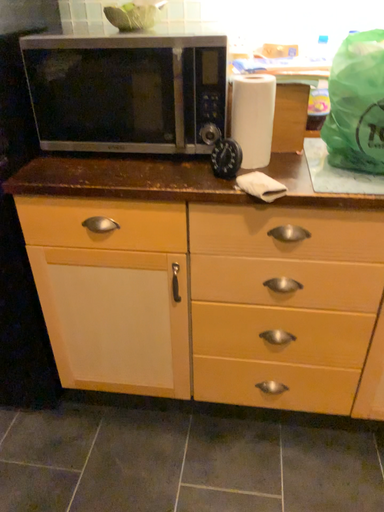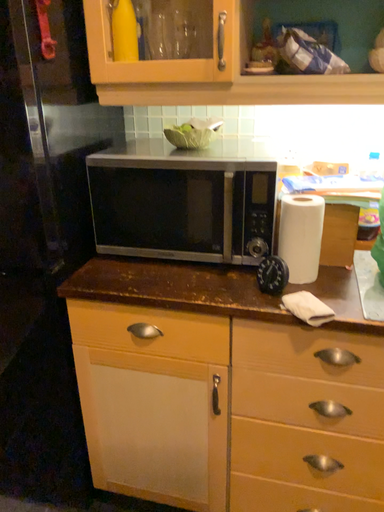
Question: How did the camera likely rotate when shooting the video?

Choices:
 (A) rotated downward
 (B) rotated upward

Answer: (B)